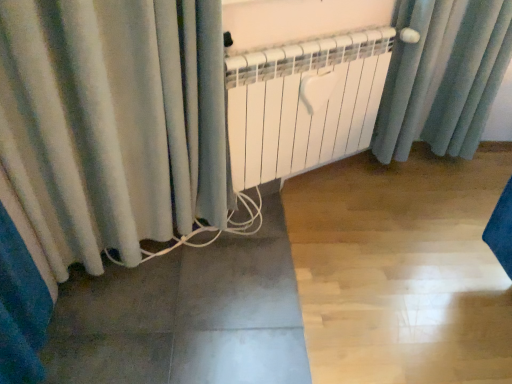
What do you see at coordinates (112, 122) in the screenshot?
I see `velvet curtain at lower left` at bounding box center [112, 122].

Image resolution: width=512 pixels, height=384 pixels. Identify the location of velvet curtain at lower left. (112, 122).

Describe the element at coordinates (303, 104) in the screenshot. This screenshot has width=512, height=384. I see `white matte radiator at center` at that location.

I want to click on white matte radiator at center, so point(303,104).

Image resolution: width=512 pixels, height=384 pixels. I want to click on velvet curtain at lower left, so click(x=112, y=122).

Can you confirm if white matte radiator at center is positioned to the left of velvet curtain at lower left?

No.

Considering the positions of objects white matte radiator at center and velvet curtain at lower left in the image provided, who is behind, white matte radiator at center or velvet curtain at lower left?

white matte radiator at center is behind.

Is point (236, 80) closer to viewer compared to point (18, 0)?

No, (236, 80) is further to viewer.

From the picture: From the image's perspective, relative to velvet curtain at lower left, is white matte radiator at center above or below?

Clearly, from the image's perspective, white matte radiator at center is above velvet curtain at lower left.

From a real-world perspective, is white matte radiator at center physically below velvet curtain at lower left?

Yes.

Which of these two, white matte radiator at center or velvet curtain at lower left, is thinner?

white matte radiator at center is thinner.

Based on the photo, considering the relative sizes of white matte radiator at center and velvet curtain at lower left in the image provided, is white matte radiator at center taller than velvet curtain at lower left?

No.

Considering the sizes of white matte radiator at center and velvet curtain at lower left in the image, is white matte radiator at center bigger or smaller than velvet curtain at lower left?

In the image, white matte radiator at center appears to be smaller than velvet curtain at lower left.

Would you say white matte radiator at center contains velvet curtain at lower left?

That's incorrect, velvet curtain at lower left is not inside white matte radiator at center.

Are white matte radiator at center and velvet curtain at lower left beside each other?

No.

Is white matte radiator at center oriented towards velvet curtain at lower left?

Answer: No.

Identify the location of radiator located on the right of velvet curtain at lower left. This screenshot has width=512, height=384. (303, 104).

In the image, is velvet curtain at lower left on the left side or the right side of white matte radiator at center?

velvet curtain at lower left is positioned on white matte radiator at center's left side.

Is velvet curtain at lower left positioned in front of white matte radiator at center?

Yes, velvet curtain at lower left is in front of white matte radiator at center.

Between point (59, 181) and point (246, 156), which one is positioned in front?

The point (59, 181) is more forward.

From the image's perspective, would you say velvet curtain at lower left is shown under white matte radiator at center?

Yes, from the image's perspective, velvet curtain at lower left is beneath white matte radiator at center.

From a real-world perspective, is velvet curtain at lower left positioned under white matte radiator at center based on gravity?

No, from a real-world perspective, velvet curtain at lower left is not beneath white matte radiator at center.

Can you confirm if velvet curtain at lower left is wider than white matte radiator at center?

Correct, the width of velvet curtain at lower left exceeds that of white matte radiator at center.

Which of these two, velvet curtain at lower left or white matte radiator at center, stands taller?

Standing taller between the two is velvet curtain at lower left.

Which of these two, velvet curtain at lower left or white matte radiator at center, is smaller?

With smaller size is white matte radiator at center.

Is white matte radiator at center inside velvet curtain at lower left?

No, white matte radiator at center is not inside velvet curtain at lower left.

Is velvet curtain at lower left next to white matte radiator at center?

velvet curtain at lower left and white matte radiator at center are clearly separated.

Is velvet curtain at lower left looking in the opposite direction of white matte radiator at center?

That's not correct — velvet curtain at lower left is not looking away from white matte radiator at center.

How much distance is there between velvet curtain at lower left and white matte radiator at center?

They are 18.01 inches apart.

Identify the location of radiator below the velvet curtain at lower left (from a real-world perspective). (303, 104).

At what (x,y) coordinates should I click in order to perform the action: click on radiator located on the right of velvet curtain at lower left. Please return your answer as a coordinate pair (x, y). Looking at the image, I should click on (303, 104).

Locate an element on the screen. This screenshot has width=512, height=384. curtain that appears above the white matte radiator at center (from a real-world perspective) is located at coordinates (112, 122).